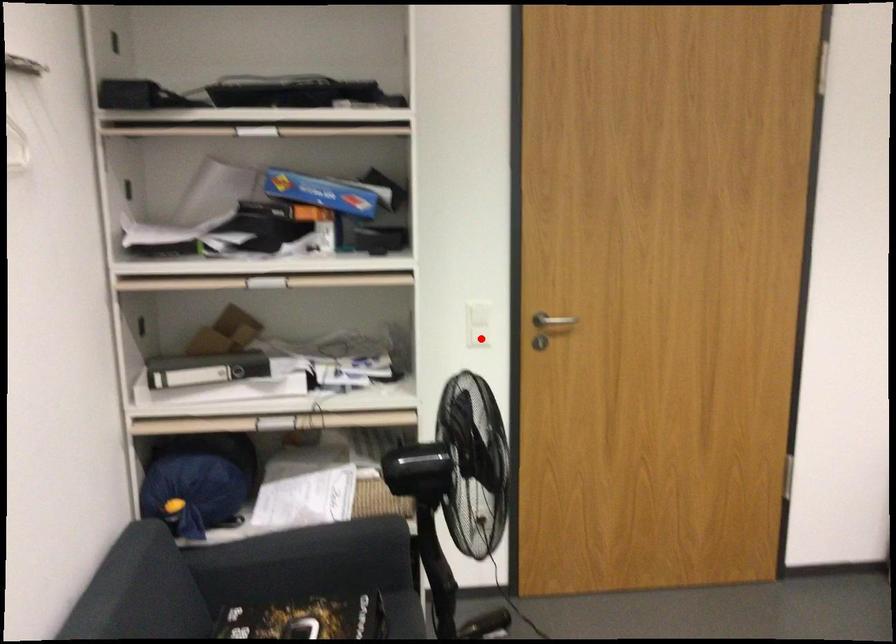
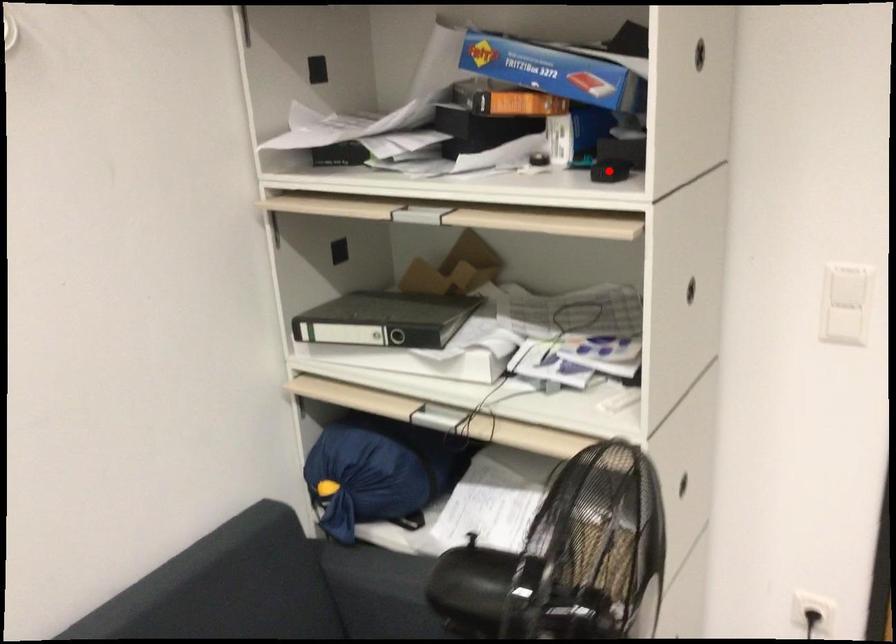
I am providing you with two images of the same scene from different viewpoints. A red point is marked on the first image and another point is marked on the second image. Do the highlighted points in image1 and image2 indicate the same real-world spot?

No